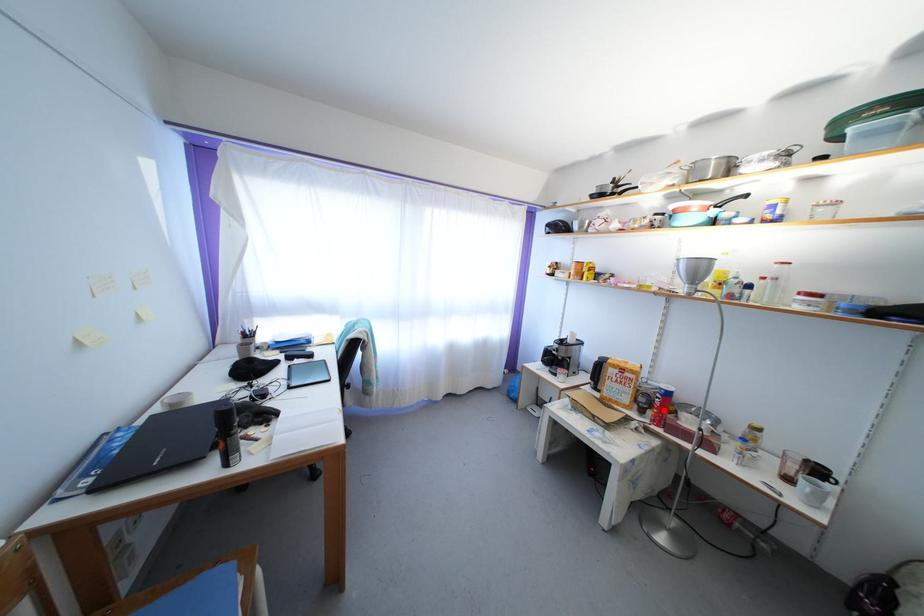
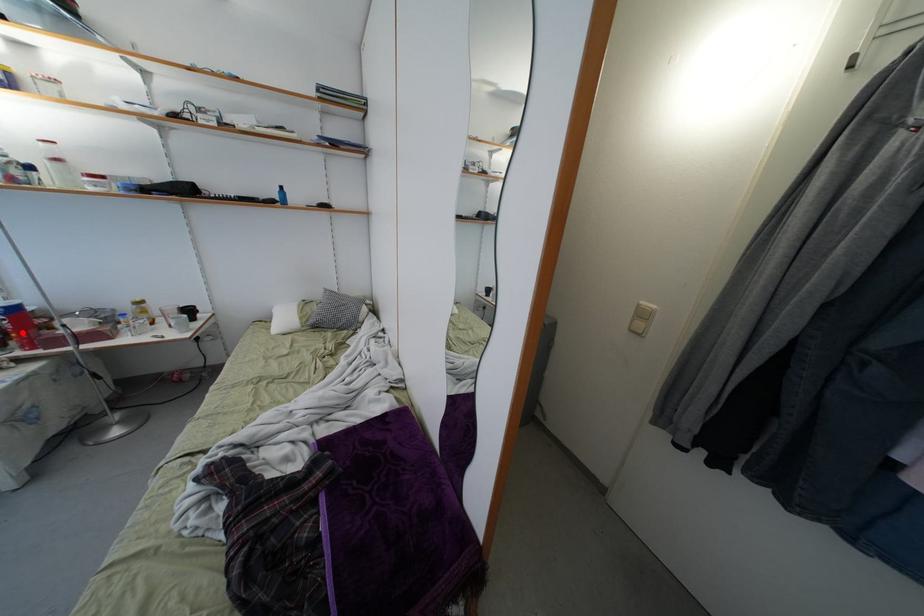
I am providing you with two images of the same scene from different viewpoints. A red point is marked on the first image and another point is marked on the second image. Does the point marked in image1 correspond to the same location as the one in image2?

Yes